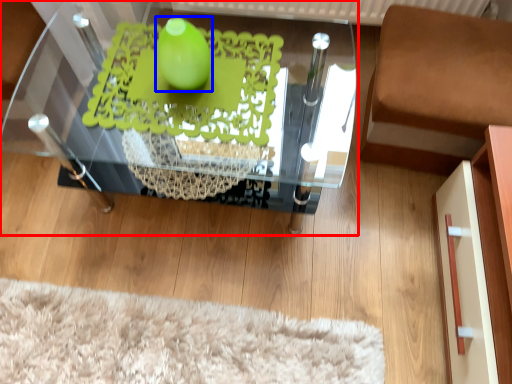
Question: Which point is closer to the camera, table (highlighted by a red box) or lime (highlighted by a blue box)?

Choices:
 (A) table
 (B) lime

Answer: (B)